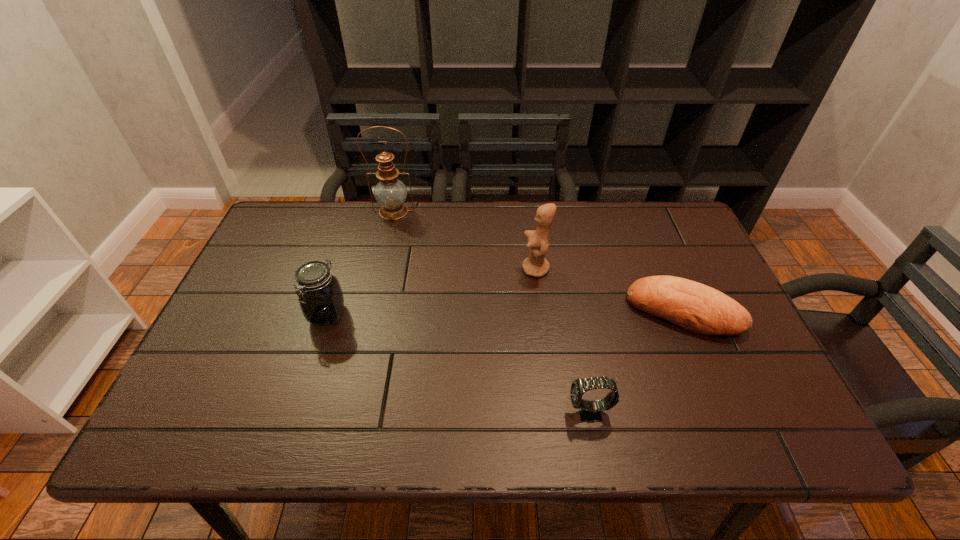
Find the location of `free region located 0.270m on the front-facing side of the fourth nearest object`. free region located 0.270m on the front-facing side of the fourth nearest object is located at coordinates (427, 269).

I want to click on vacant space located 0.380m on the front-facing side of the fourth nearest object, so click(x=388, y=269).

At what (x,y) coordinates should I click in order to perform the action: click on free point located 0.320m on the front-facing side of the fourth nearest object. Please return your answer as a coordinate pair (x, y). Looking at the image, I should click on (409, 269).

Where is `vacant space positioned 0.100m on the lid of the third tallest object`? vacant space positioned 0.100m on the lid of the third tallest object is located at coordinates (311, 365).

Image resolution: width=960 pixels, height=540 pixels. Identify the location of vacant space located 0.140m on the face of the nearest object. (502, 413).

The height and width of the screenshot is (540, 960). In order to click on vacant space located 0.350m on the face of the nearest object in this screenshot , I will do `click(403, 413)`.

Locate an element on the screen. The image size is (960, 540). vacant space located on the face of the nearest object is located at coordinates (525, 413).

You are a GUI agent. You are given a task and a screenshot of the screen. Output one action in this format:
    pyautogui.click(x=<x>, y=<y>)
    Task: Click on the free point located 0.060m on the left of the shortest object
    This screenshot has height=540, width=960.
    Given the screenshot: What is the action you would take?
    pyautogui.click(x=607, y=312)

Where is `object located in the far edge section of the desktop`? object located in the far edge section of the desktop is located at coordinates coord(390,193).

At what (x,y) coordinates should I click in order to perform the action: click on object that is positioned at the near edge. Please return your answer as a coordinate pair (x, y). Image resolution: width=960 pixels, height=540 pixels. Looking at the image, I should click on (590, 411).